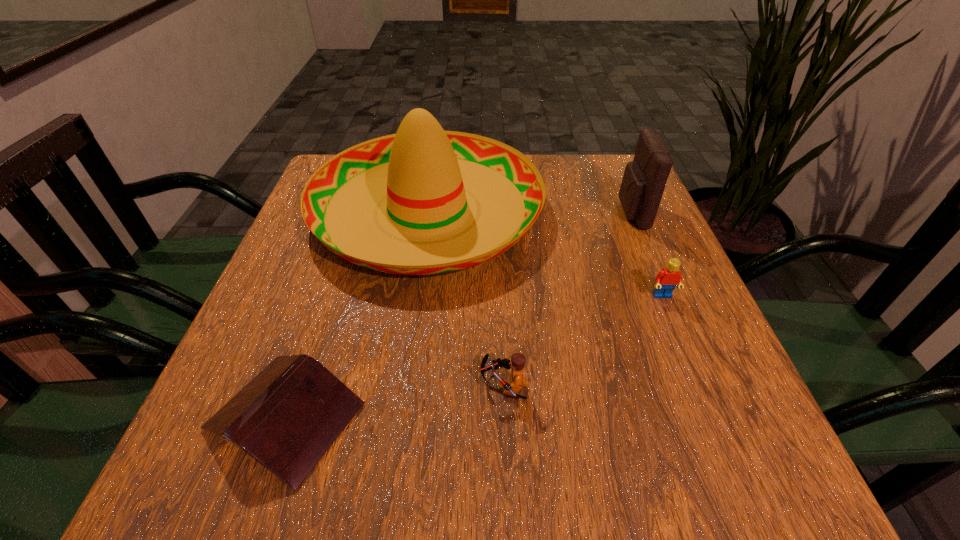
The height and width of the screenshot is (540, 960). In order to click on the tallest object in this screenshot , I will do `click(422, 172)`.

Where is `pouch`? This screenshot has width=960, height=540. pouch is located at coordinates (644, 180).

Image resolution: width=960 pixels, height=540 pixels. Identify the location of the farther Lego. (666, 280).

Locate an element on the screen. The height and width of the screenshot is (540, 960). the left Lego is located at coordinates (518, 360).

Locate an element on the screen. the shortest object is located at coordinates (287, 417).

The image size is (960, 540). What are the coordinates of `vacant space located on the right of the tallest object` in the screenshot? It's located at (639, 210).

Image resolution: width=960 pixels, height=540 pixels. In order to click on vacant space located 0.250m with an open flap on the second tallest object in this screenshot , I will do `click(513, 213)`.

The width and height of the screenshot is (960, 540). In order to click on free location located 0.050m with an open flap on the second tallest object in this screenshot , I will do `click(597, 213)`.

Identify the location of free space located 0.210m with an open flap on the second tallest object. (529, 213).

Where is `vacant space situated on the face of the right Lego`? vacant space situated on the face of the right Lego is located at coordinates (706, 402).